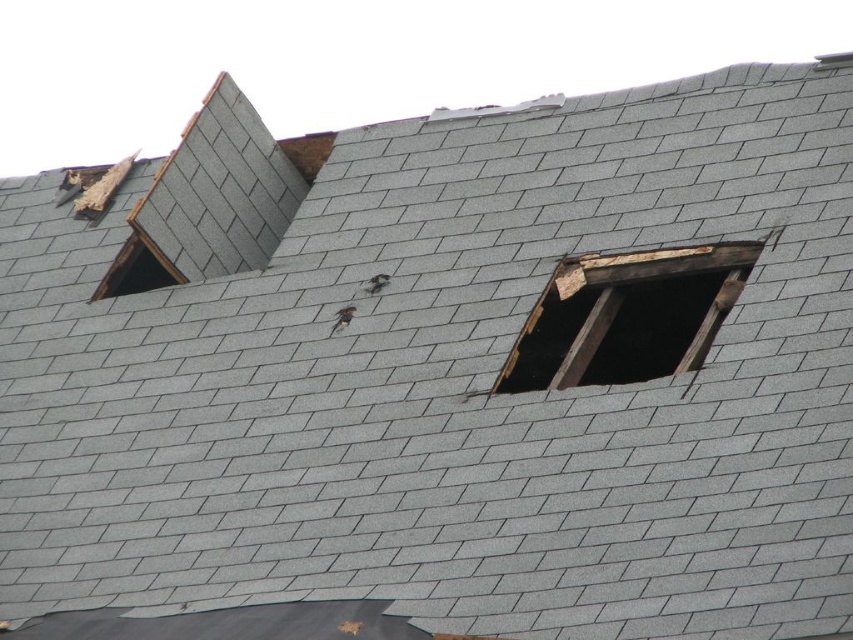
Looking at this image, can you confirm if weathered wood window at upper right is positioned below transparent glass window at upper left?

Correct, weathered wood window at upper right is located below transparent glass window at upper left.

Is weathered wood window at upper right smaller than transparent glass window at upper left?

No, weathered wood window at upper right is not smaller than transparent glass window at upper left.

Between point (596, 259) and point (100, 284), which one is positioned in front?

Positioned in front is point (596, 259).

Find the location of a particular element. The image size is (853, 640). weathered wood window at upper right is located at coordinates (624, 314).